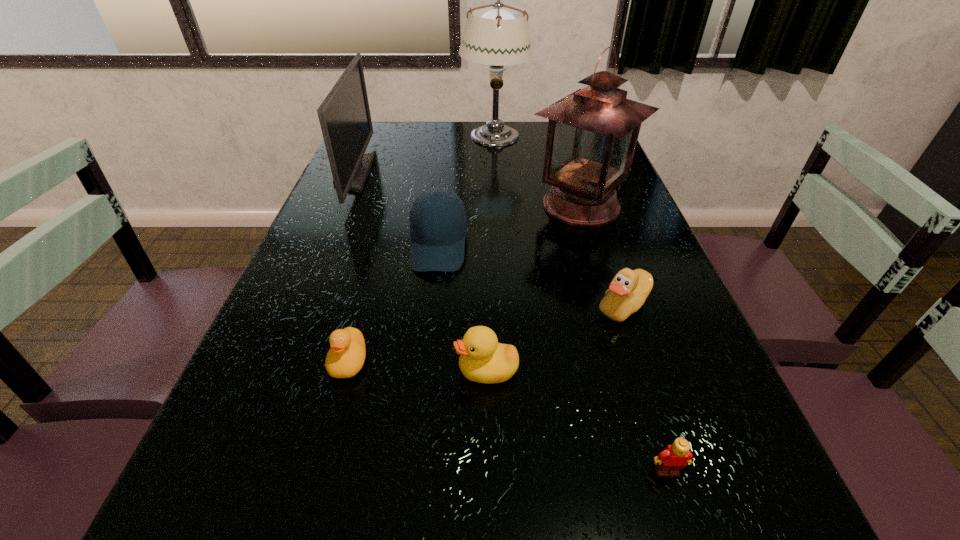
Locate an element on the screen. The image size is (960, 540). vacant space located at the beak of the second duck from left to right is located at coordinates (318, 370).

At what (x,y) coordinates should I click in order to perform the action: click on free point located on the face of the second object from left to right. Please return your answer as a coordinate pair (x, y). Looking at the image, I should click on (313, 494).

Find the location of `lampshade that is at the far edge`. lampshade that is at the far edge is located at coordinates (495, 36).

This screenshot has width=960, height=540. Find the location of `monitor that is positioned at the far edge`. monitor that is positioned at the far edge is located at coordinates (344, 115).

This screenshot has height=540, width=960. I want to click on monitor that is at the left edge, so click(x=344, y=115).

This screenshot has width=960, height=540. What are the coordinates of `duck located in the left edge section of the desktop` in the screenshot? It's located at (346, 357).

This screenshot has height=540, width=960. Identify the location of oil lamp that is at the right edge. (592, 134).

You are a GUI agent. You are given a task and a screenshot of the screen. Output one action in this format:
    pyautogui.click(x=<x>, y=<y>)
    Task: Click on the duck located in the right edge section of the desktop
    
    Given the screenshot: What is the action you would take?
    pyautogui.click(x=629, y=289)

The width and height of the screenshot is (960, 540). I want to click on Lego at the right edge, so click(673, 458).

Identify the location of object at the far left corner. (344, 115).